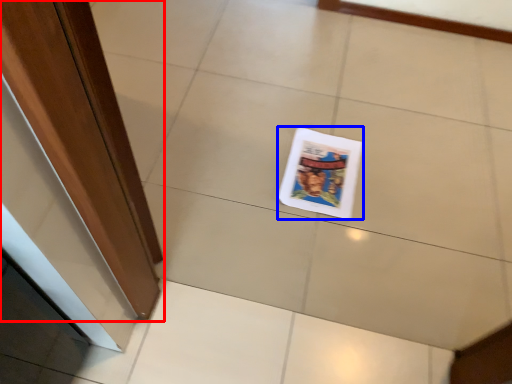
Question: Among these objects, which one is farthest to the camera, door (highlighted by a red box) or magazine (highlighted by a blue box)?

Choices:
 (A) door
 (B) magazine

Answer: (B)